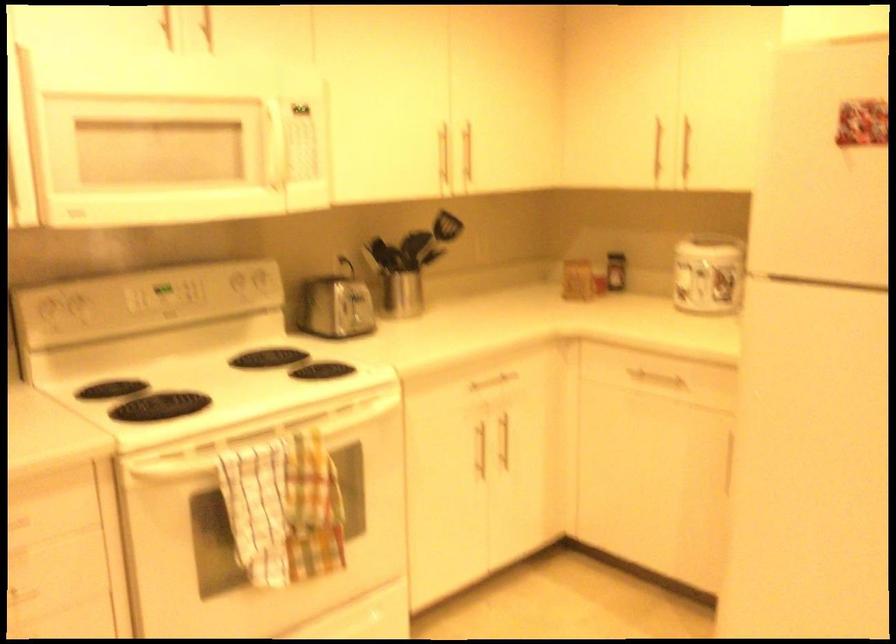
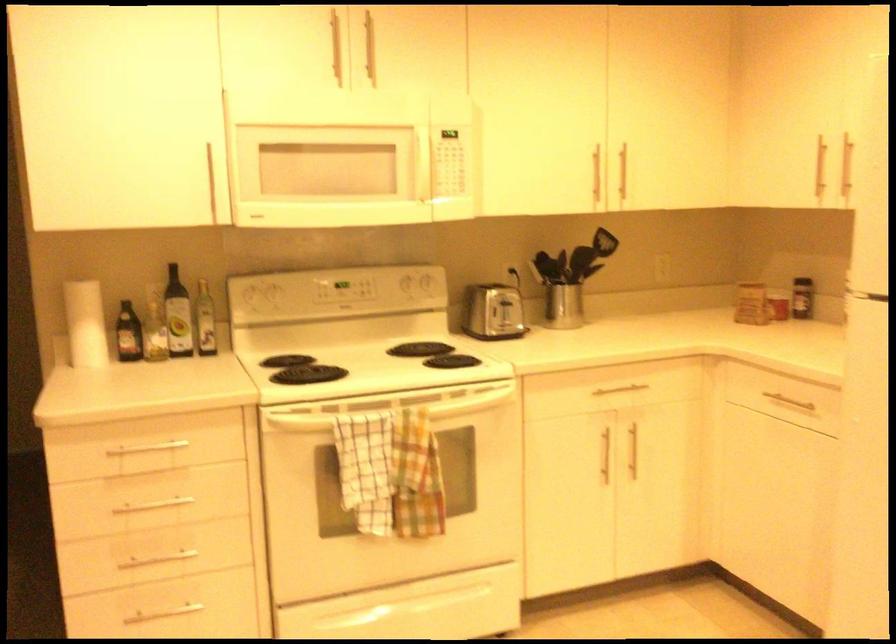
Question: The camera is either moving clockwise (left) or counter-clockwise (right) around the object. The first image is from the beginning of the video and the second image is from the end. Is the camera moving left or right when shooting the video?

Choices:
 (A) Left
 (B) Right

Answer: (B)